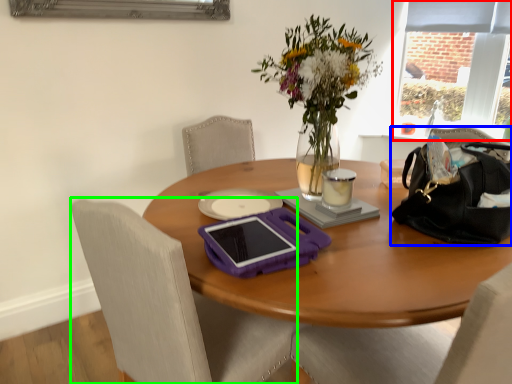
Question: Considering the real-world distances, which object is closest to window screen (highlighted by a red box)? handbag (highlighted by a blue box) or chair (highlighted by a green box).

Choices:
 (A) handbag
 (B) chair

Answer: (A)